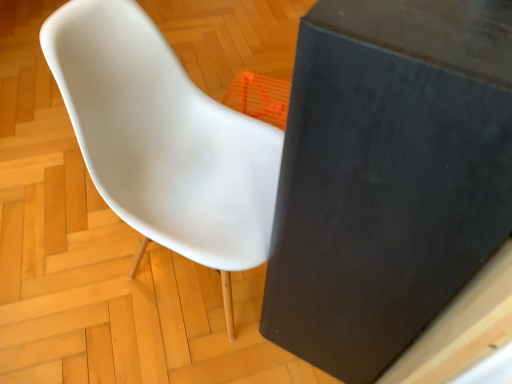
This screenshot has width=512, height=384. In order to click on free location to the left of white matte chair at center in this screenshot , I will do `click(64, 260)`.